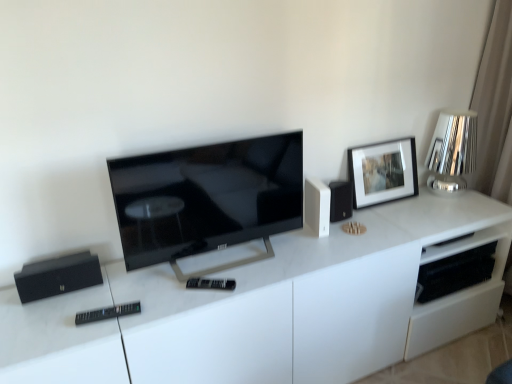
Find the location of a particular element. vacant space that is to the left of black plastic remote at lower left, the 1th remote in the front-to-back sequence is located at coordinates (59, 323).